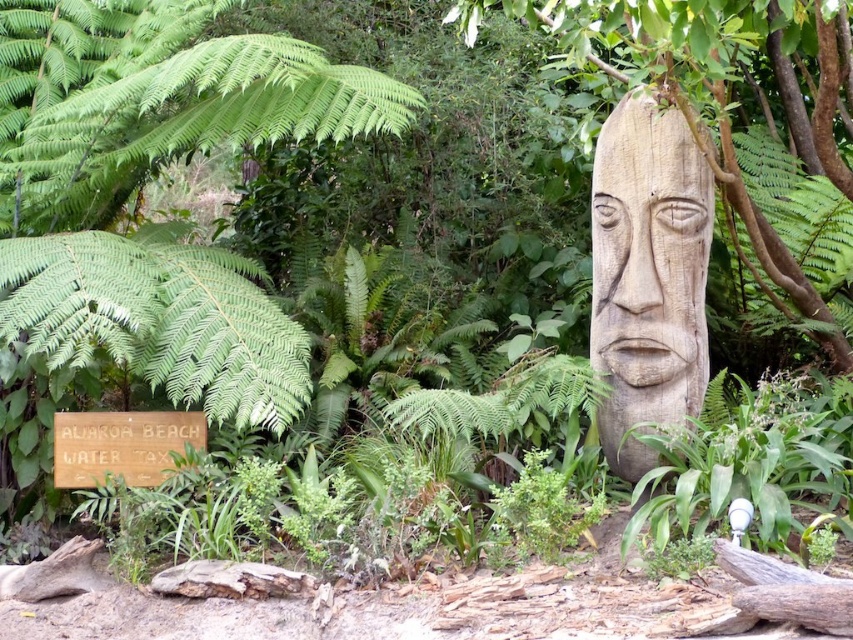
Can you confirm if wooden carving at center is positioned below wooden sign at lower left?

Actually, wooden carving at center is above wooden sign at lower left.

Which is above, wooden carving at center or wooden sign at lower left?

wooden carving at center is higher up.

Who is more forward, (631, 180) or (202, 448)?

Point (631, 180) is more forward.

Where is `wooden carving at center`? Image resolution: width=853 pixels, height=640 pixels. wooden carving at center is located at coordinates (648, 248).